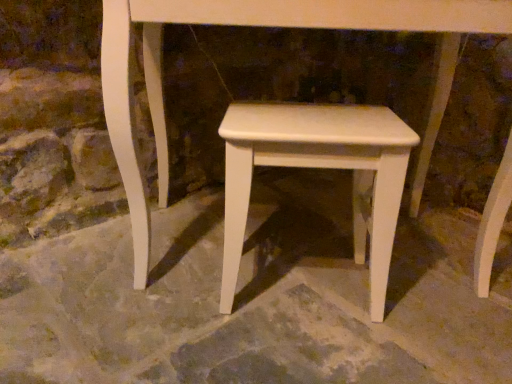
Question: Can you confirm if white matte stool at center is thinner than white smooth concrete at center?

Choices:
 (A) yes
 (B) no

Answer: (A)

Question: Does white matte stool at center have a greater height compared to white smooth concrete at center?

Choices:
 (A) no
 (B) yes

Answer: (B)

Question: Does white matte stool at center have a smaller size compared to white smooth concrete at center?

Choices:
 (A) no
 (B) yes

Answer: (B)

Question: From the image's perspective, is white matte stool at center under white smooth concrete at center?

Choices:
 (A) yes
 (B) no

Answer: (B)

Question: Can white smooth concrete at center be found inside white matte stool at center?

Choices:
 (A) yes
 (B) no

Answer: (B)

Question: Is white matte stool at center aimed at white smooth concrete at center?

Choices:
 (A) yes
 (B) no

Answer: (B)

Question: Is white smooth concrete at center closer to the viewer compared to white matte stool at center?

Choices:
 (A) yes
 (B) no

Answer: (A)

Question: Is white smooth concrete at center aimed at white matte stool at center?

Choices:
 (A) no
 (B) yes

Answer: (A)

Question: Can you confirm if white smooth concrete at center is wider than white matte stool at center?

Choices:
 (A) yes
 (B) no

Answer: (A)

Question: From the image's perspective, is white smooth concrete at center below white matte stool at center?

Choices:
 (A) yes
 (B) no

Answer: (A)

Question: Is white smooth concrete at center to the left of white matte stool at center from the viewer's perspective?

Choices:
 (A) no
 (B) yes

Answer: (B)

Question: Considering the relative sizes of white smooth concrete at center and white matte stool at center in the image provided, is white smooth concrete at center bigger than white matte stool at center?

Choices:
 (A) no
 (B) yes

Answer: (B)

Question: Considering the positions of white matte stool at center and white smooth concrete at center in the image, is white matte stool at center bigger or smaller than white smooth concrete at center?

Choices:
 (A) big
 (B) small

Answer: (B)